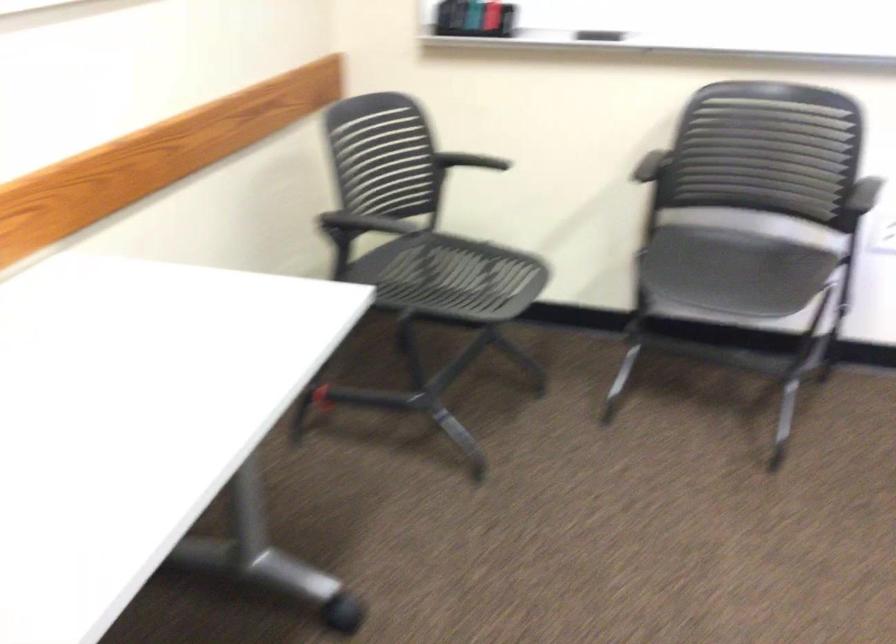
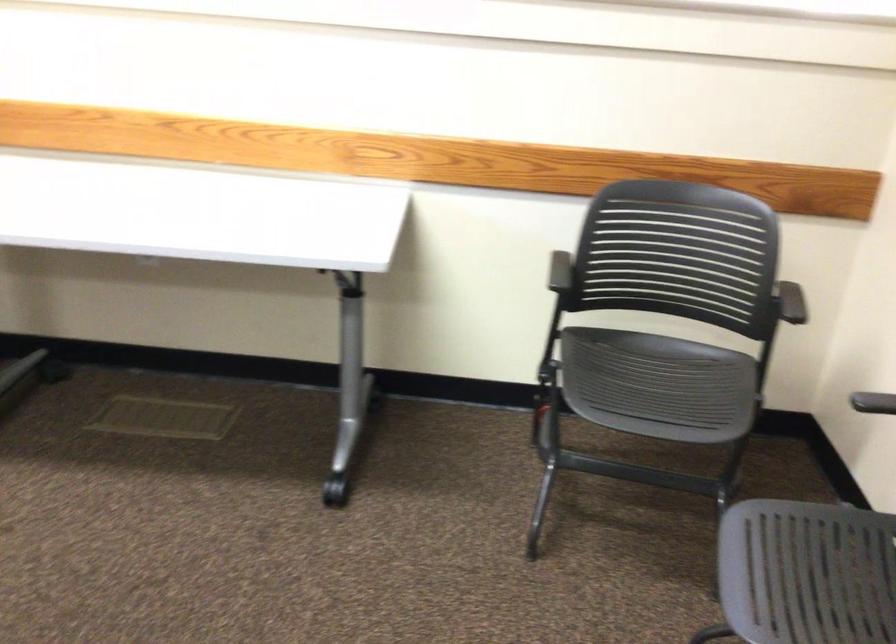
In the second image, find the point that corresponds to (x=440, y=279) in the first image.

(658, 384)